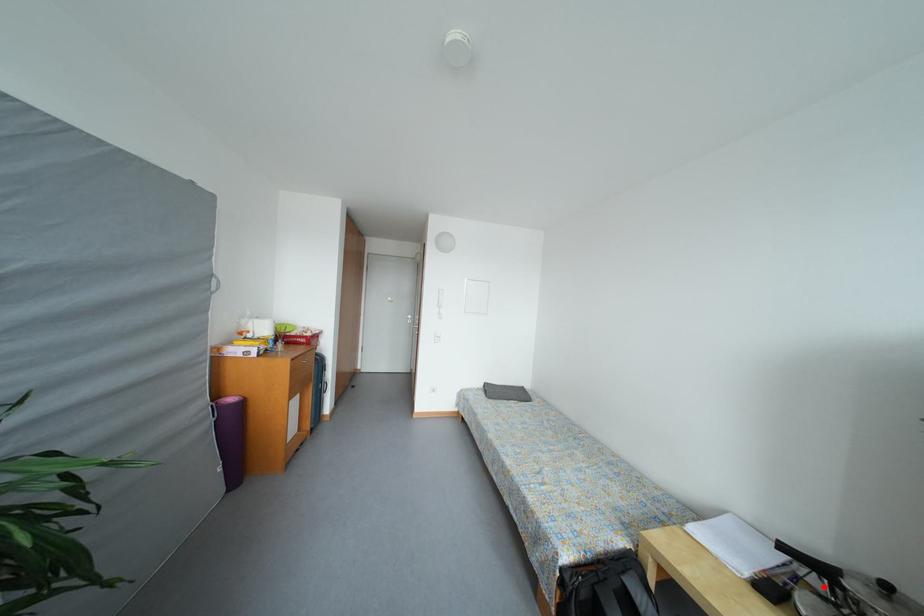
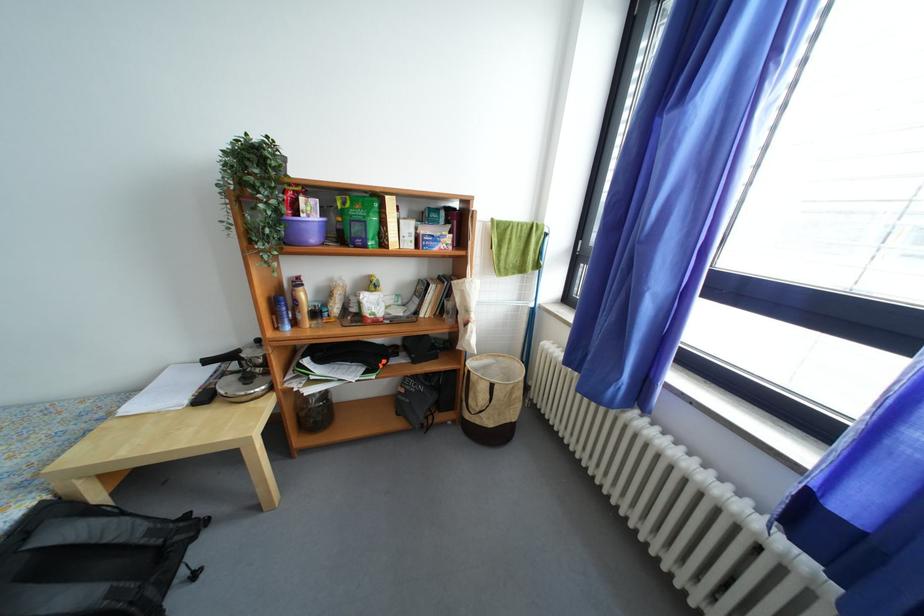
Where in the second image is the point corresponding to the highlighted location from the first image?

(240, 371)